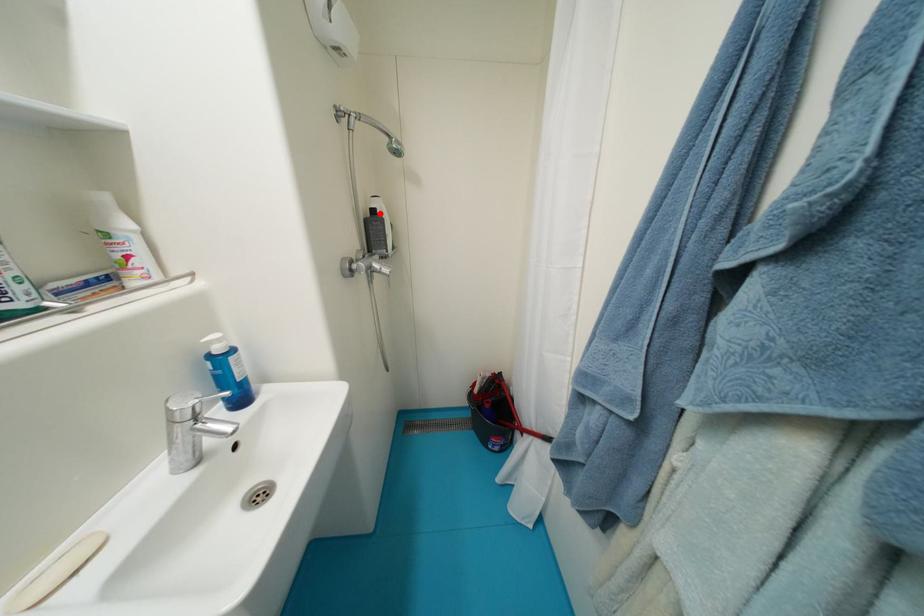
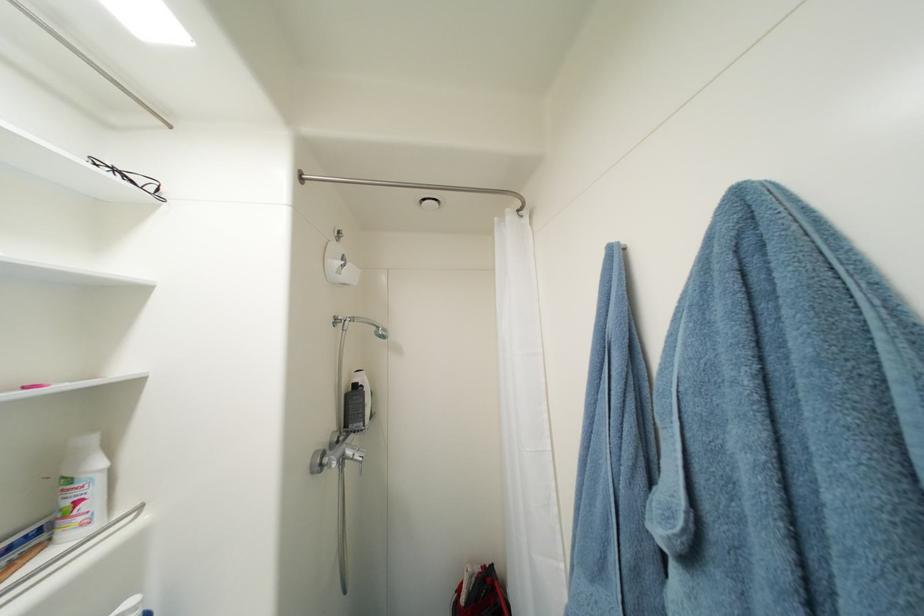
Where in the second image is the point corresponding to the highlighted location from the first image?

(361, 387)